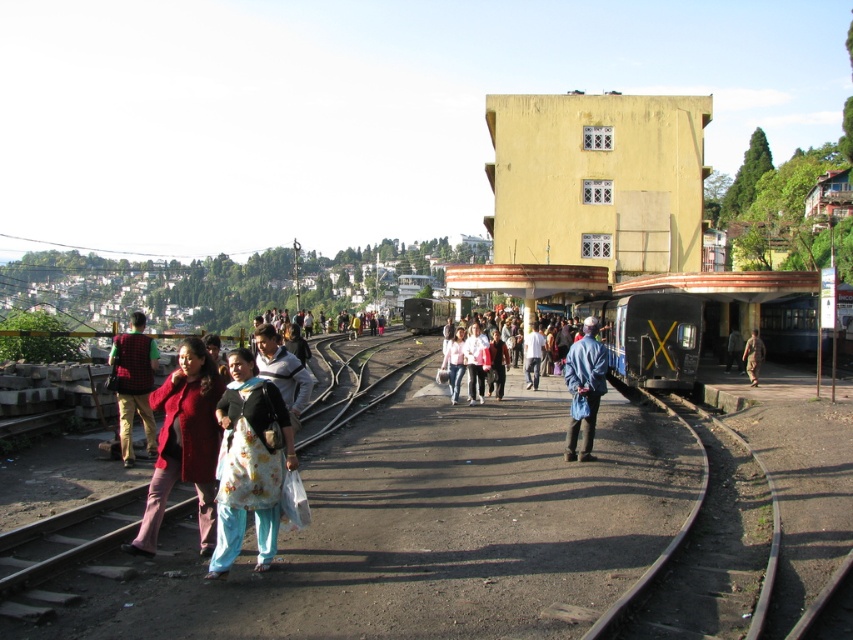
Which is behind, point (113, 339) or point (469, 380)?

Point (469, 380)

Between matte red shirt at left and light pink fabric at center, which one has more height?

With more height is light pink fabric at center.

What do you see at coordinates (134, 385) in the screenshot? The image size is (853, 640). I see `matte red shirt at left` at bounding box center [134, 385].

You are a GUI agent. You are given a task and a screenshot of the screen. Output one action in this format:
    pyautogui.click(x=<x>, y=<y>)
    Task: Click on the matte red shirt at left
    This screenshot has width=853, height=640.
    Given the screenshot: What is the action you would take?
    tap(134, 385)

Is blue fabric jacket at center bigger than camouflage fabric jacket at center?

No, blue fabric jacket at center is not bigger than camouflage fabric jacket at center.

At what (x,y) coordinates should I click in order to perform the action: click on blue fabric jacket at center. Please return your answer as a coordinate pair (x, y). Looking at the image, I should click on (585, 385).

Between matte red shirt at left and blue fabric jacket at center, which one has less height?

Standing shorter between the two is matte red shirt at left.

Can you confirm if matte red shirt at left is taller than blue fabric jacket at center?

No.

Who is more forward, (138, 365) or (584, 424)?

Positioned in front is point (138, 365).

You are a GUI agent. You are given a task and a screenshot of the screen. Output one action in this format:
    pyautogui.click(x=<x>, y=<y>)
    Task: Click on the matte red shirt at left
    The height and width of the screenshot is (640, 853).
    Given the screenshot: What is the action you would take?
    pyautogui.click(x=134, y=385)